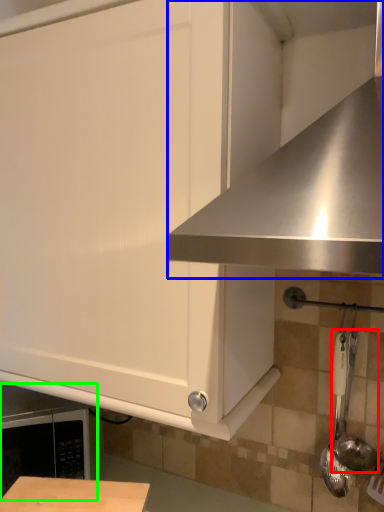
Question: Which is nearer to the utensil (highlighted by a red box)? exhaust hood (highlighted by a blue box) or appliance (highlighted by a green box).

Choices:
 (A) exhaust hood
 (B) appliance

Answer: (A)